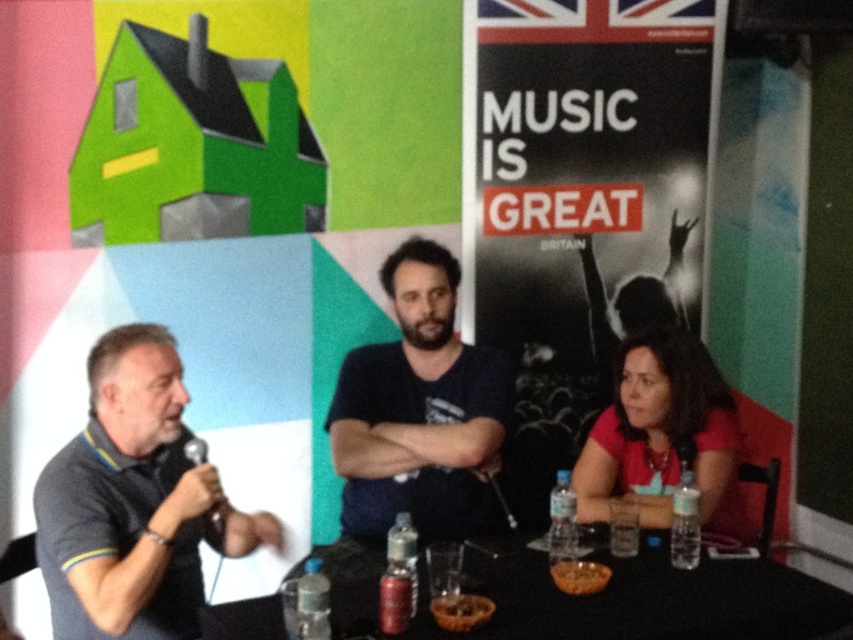
You are a photographer positioned to the side of the table capturing a photo of the three individuals. The transparent plastic bottle at table center is in your shot. Where should you position your camera to ensure the bottle is centered in the photo?

To center the transparent plastic bottle at table center in the photo, position your camera directly aligned with its coordinates at point (561, 518).

You are a photographer standing 10 feet away from the transparent plastic bottle at table center. You want to take a photo of the bottle. Do you need to move closer or farther away to focus on it properly?

The transparent plastic bottle at table center is 7.24 feet away from the camera. Since you are currently 10 feet away, you need to move closer by approximately 2.76 feet to match the focus distance of 7.24 feet.

In the scene shown: You are organizing a photo shoot and need to ensure all items on the table are visible in the frame. The transparent plastic bottle at table center is currently blocking part of the red matte shirt at lower right. How should you adjust their positions to make both fully visible?

Move the transparent plastic bottle at table center slightly to the left so that the red matte shirt at lower right is no longer blocked, ensuring both items are fully visible in the frame.